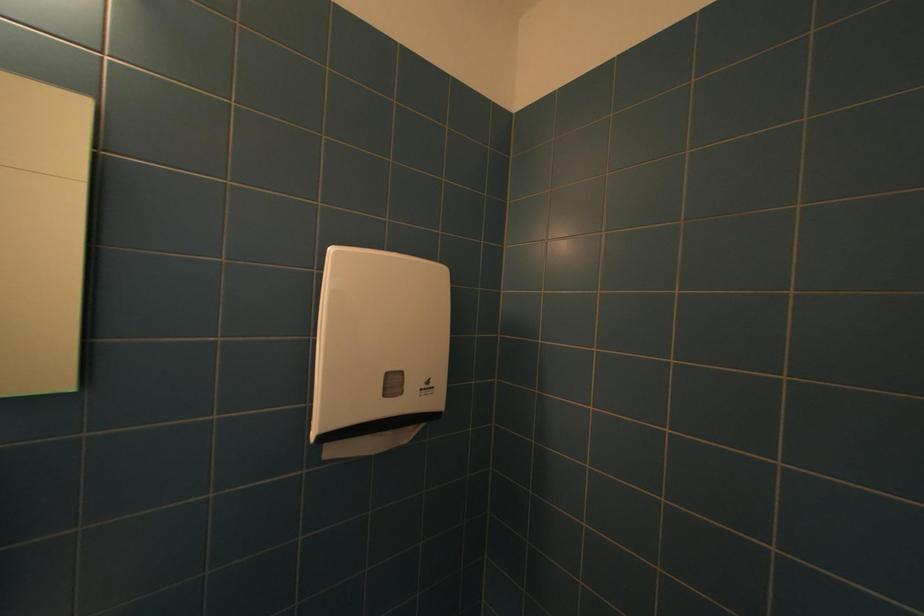
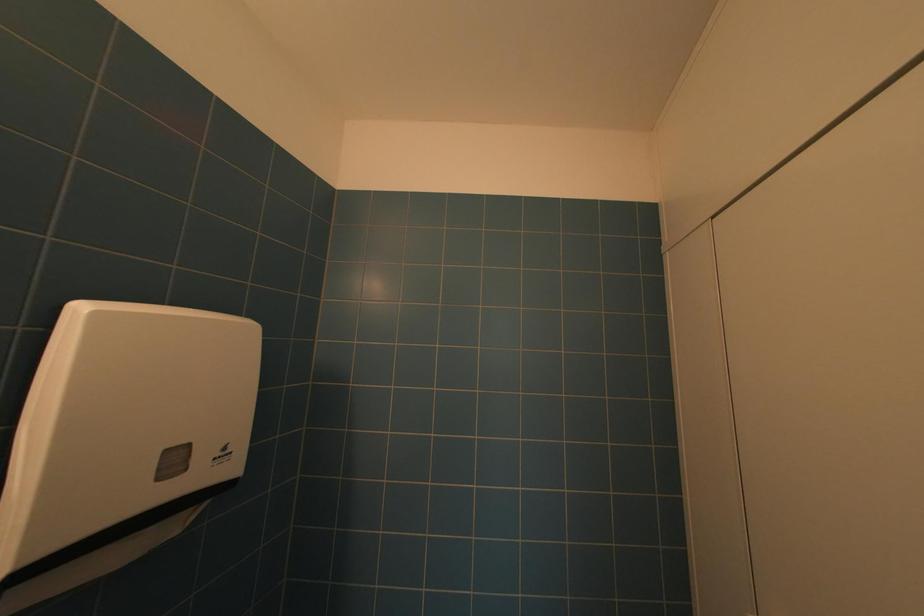
Question: The camera is either moving clockwise (left) or counter-clockwise (right) around the object. The first image is from the beginning of the video and the second image is from the end. Is the camera moving left or right when shooting the video?

Choices:
 (A) Left
 (B) Right

Answer: (A)